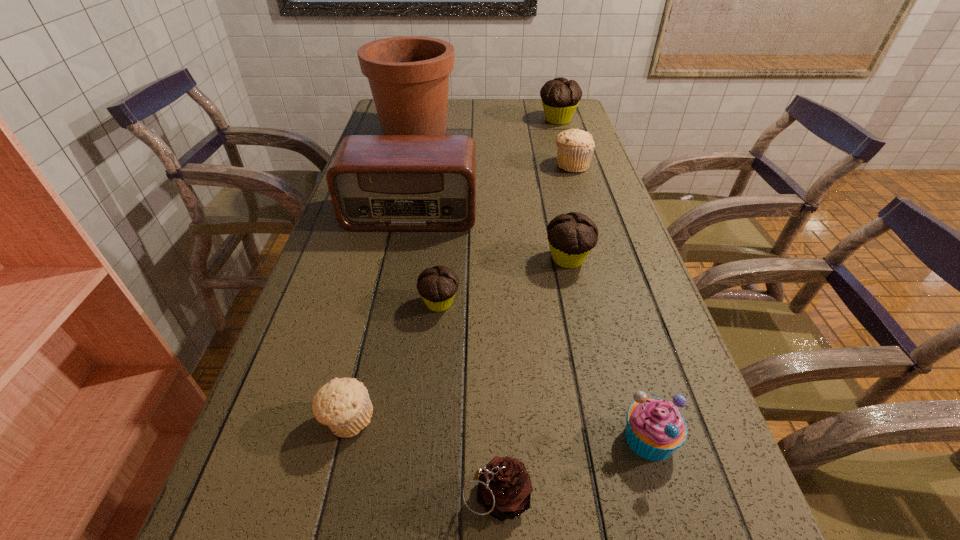
Identify the location of vacant space that satisfies the following two spatial constraints: 1. on the front side of the blue muffin; 2. with a leaf charm attached to the pinecone. The width and height of the screenshot is (960, 540). (666, 495).

The image size is (960, 540). Find the location of `vacant space that satisfies the following two spatial constraints: 1. on the front panel of the fifth nearest object; 2. on the left side of the sixth nearest object`. vacant space that satisfies the following two spatial constraints: 1. on the front panel of the fifth nearest object; 2. on the left side of the sixth nearest object is located at coordinates (402, 259).

Locate an element on the screen. The width and height of the screenshot is (960, 540). free region that satisfies the following two spatial constraints: 1. on the front side of the blue muffin; 2. on the right side of the third farthest muffin is located at coordinates (608, 437).

Find the location of a particular element. The image size is (960, 540). vacant area that satisfies the following two spatial constraints: 1. on the front side of the left beige muffin; 2. on the right side of the blue muffin is located at coordinates (344, 437).